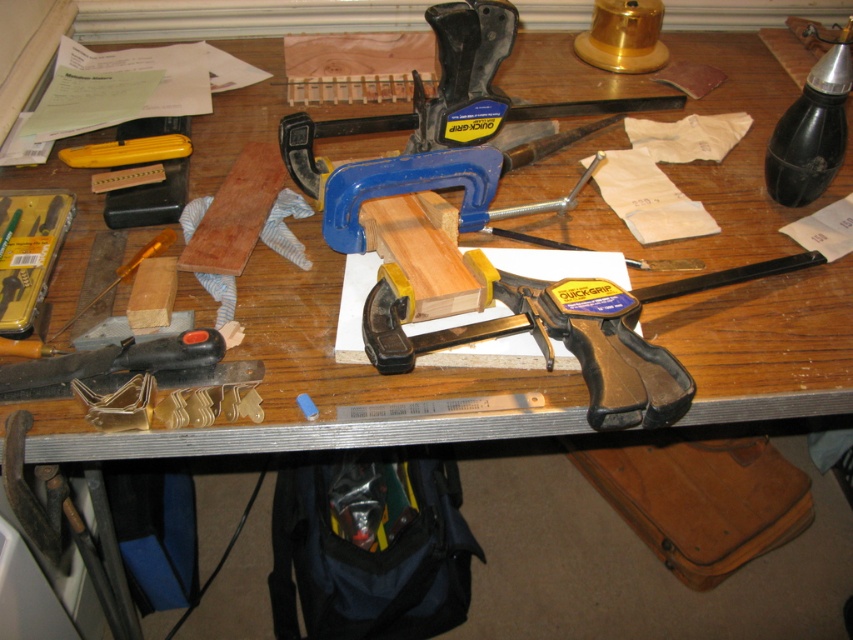
What do you see at coordinates (235, 212) in the screenshot?
I see `wooden plank at center` at bounding box center [235, 212].

Identify the location of wooden plank at center. Image resolution: width=853 pixels, height=640 pixels. (235, 212).

In the scene shown: Does wooden plank at center have a greater width compared to black plastic utility knife at lower left?

No.

Can you confirm if wooden plank at center is shorter than black plastic utility knife at lower left?

Incorrect, wooden plank at center's height does not fall short of black plastic utility knife at lower left's.

Who is more forward, (245, 214) or (195, 355)?

Point (195, 355) is in front.

At what (x,y) coordinates should I click in order to perform the action: click on wooden plank at center. Please return your answer as a coordinate pair (x, y). Image resolution: width=853 pixels, height=640 pixels. Looking at the image, I should click on [x=235, y=212].

Can you confirm if matte plastic clamp at center is positioned below satin chrome screwdriver at lower left?

Yes.

Which is below, matte plastic clamp at center or satin chrome screwdriver at lower left?

Positioned lower is matte plastic clamp at center.

The width and height of the screenshot is (853, 640). I want to click on matte plastic clamp at center, so click(x=550, y=342).